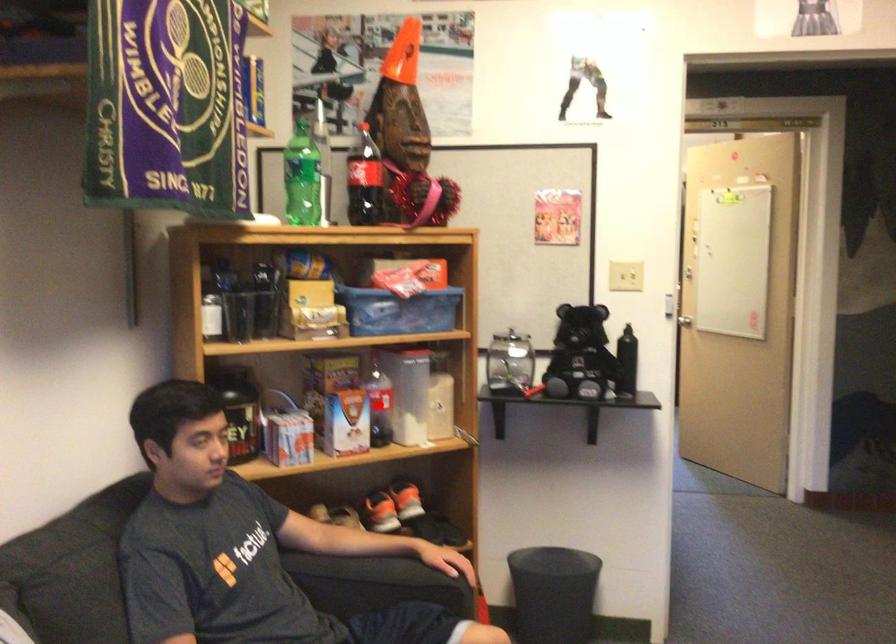
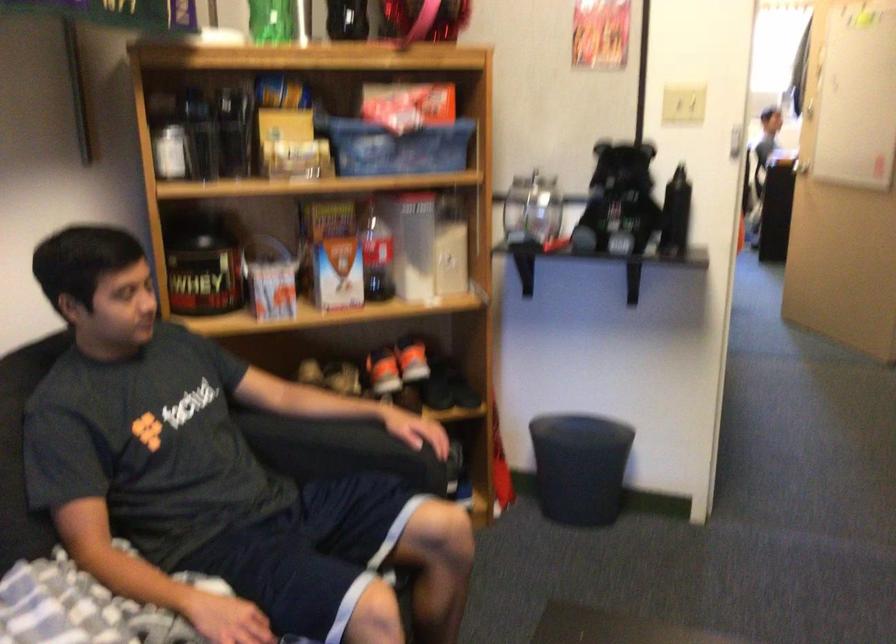
Question: I am providing you with two images of the same scene from different viewpoints. In image1, a red point is highlighted. Considering the same 3D point in image2, which of the following is correct?

Choices:
 (A) It is closer
 (B) It is farther

Answer: (A)